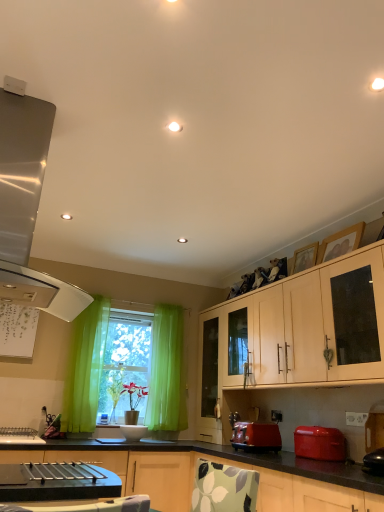
Find the location of a particular element. The width and height of the screenshot is (384, 512). vacant area on top of satin metallic range hood at left (from a real-world perspective) is located at coordinates (62, 115).